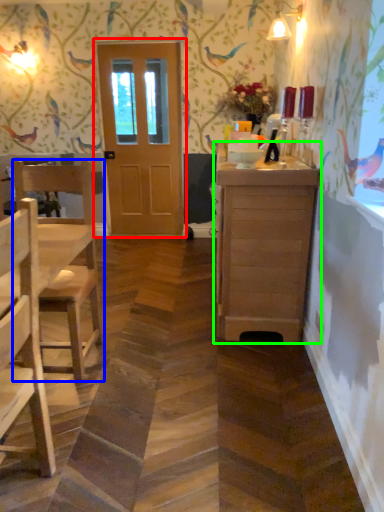
Question: Which object is the closest to the door (highlighted by a red box)? Choose among these: chair (highlighted by a blue box) or cabinetry (highlighted by a green box).

Choices:
 (A) chair
 (B) cabinetry

Answer: (A)